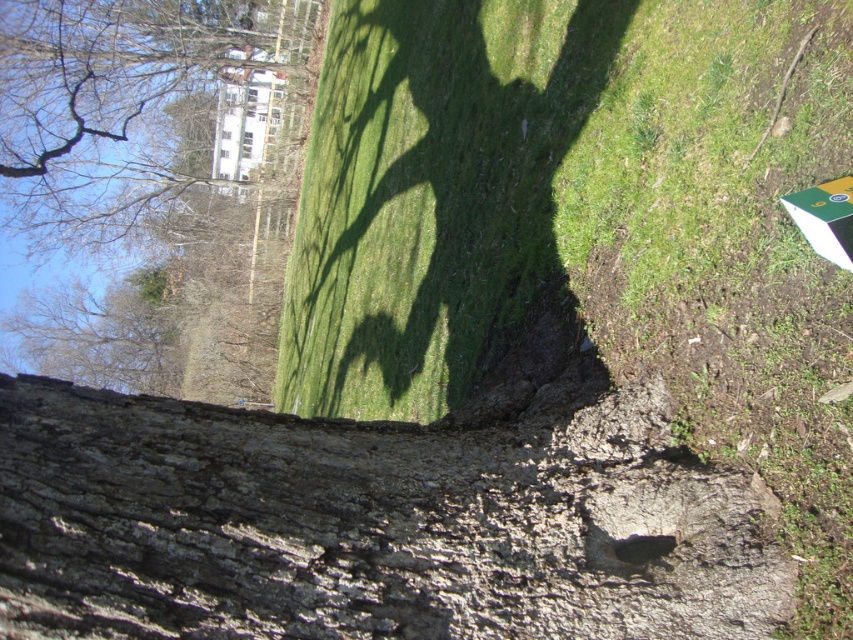
You are standing at the base of the tree trunk looking up. There is a point marked at coordinates (169, 420) on the tree trunk. If you want to touch this point with a stick that is 3 meters long, will the stick reach it?

The distance of point (169, 420) from the viewer is 3.26 meters. Since the stick is only 3 meters long, it cannot reach the point.

You are standing in front of a tree and looking up at its trunk. You notice a specific point marked at coordinates (368, 524). Based on the scene description, where exactly is this point located on the tree?

The point at coordinates (368, 524) is located on the rough bark tree trunk at lower center.

You are a bird trying to land on a tree trunk. You need to choose between the rough bark tree trunk at lower center and the smooth bark tree at upper left. Which one is thinner and easier to perch on?

The rough bark tree trunk at lower center is thinner than the smooth bark tree at upper left, so it is easier to perch on.